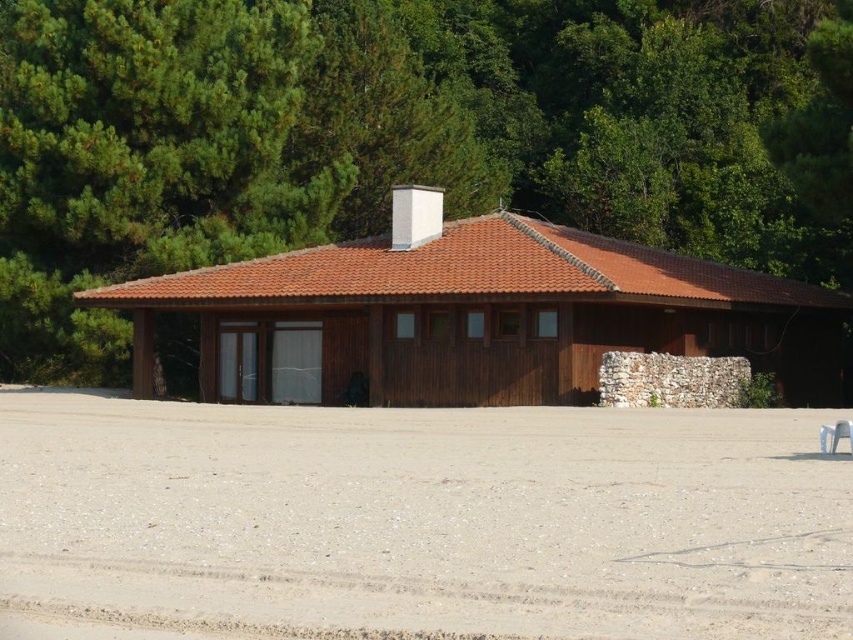
You are standing in front of the rustic wooden building with a red tiled roof. You want to take a photo of the building with the green leafy tree at upper center in the background. Where should you position yourself relative to the building to ensure the tree is fully visible in the frame?

Position yourself to the left of the building so that the green leafy tree at upper center at point (x=389, y=138) is within the camera frame.

You are standing at the entrance of the rustic wooden building and want to plant a new tree in the gray gravel at lower center. The green leafy tree at upper center is already present. Based on their positions, will the new tree you want to plant be visible from the entrance?

The green leafy tree at upper center is above gray gravel at lower center, so planting a new tree in the gray gravel at lower center would likely be visible from the entrance since it is positioned lower and not blocked by the existing tree.

You are standing in front of the brown wooden hut at center and want to reach the green leafy tree at upper center. Which direction should you walk to get there?

The green leafy tree at upper center is positioned on the right side of the brown wooden hut at center, so you should walk to the right to reach it.